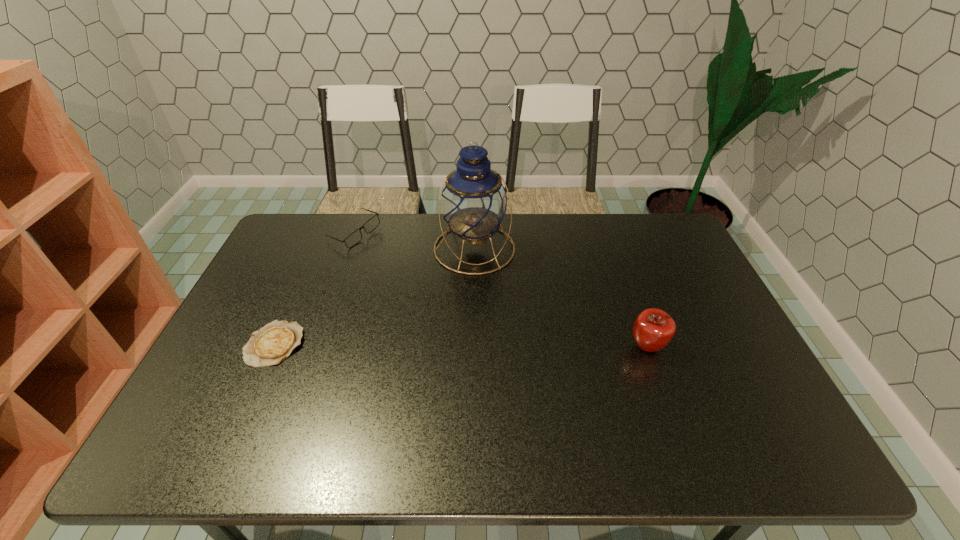
Find the location of a particular element. The width and height of the screenshot is (960, 540). quiche is located at coordinates (270, 345).

Locate an element on the screen. This screenshot has width=960, height=540. the rightmost object is located at coordinates (653, 329).

This screenshot has width=960, height=540. Find the location of `apple`. apple is located at coordinates (653, 329).

The height and width of the screenshot is (540, 960). I want to click on the tallest object, so click(x=474, y=201).

The height and width of the screenshot is (540, 960). I want to click on the second object from right to left, so click(x=474, y=201).

This screenshot has height=540, width=960. I want to click on spectacles, so click(x=355, y=237).

Locate an element on the screen. The image size is (960, 540). free spot located 0.190m on the right of the shortest object is located at coordinates (373, 344).

Image resolution: width=960 pixels, height=540 pixels. In order to click on vacant space situated 0.150m on the right of the third shortest object in this screenshot , I will do `click(721, 347)`.

The width and height of the screenshot is (960, 540). What are the coordinates of `vacant area situated 0.100m on the front-facing side of the lantern` in the screenshot? It's located at (484, 298).

The width and height of the screenshot is (960, 540). I want to click on vacant space positioned 0.060m on the front-facing side of the lantern, so click(x=482, y=288).